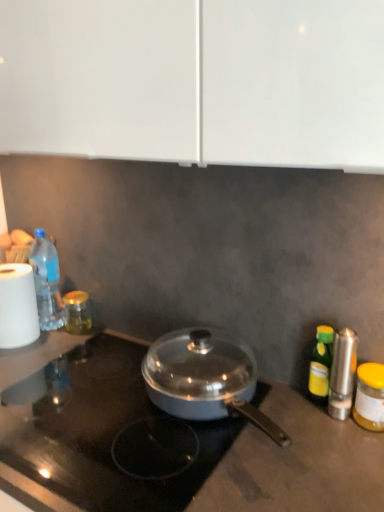
The height and width of the screenshot is (512, 384). Find the location of `free space on the front side of translucent plastic bottle at left, which ranks as the third bottle in front-to-back order`. free space on the front side of translucent plastic bottle at left, which ranks as the third bottle in front-to-back order is located at coordinates (51, 356).